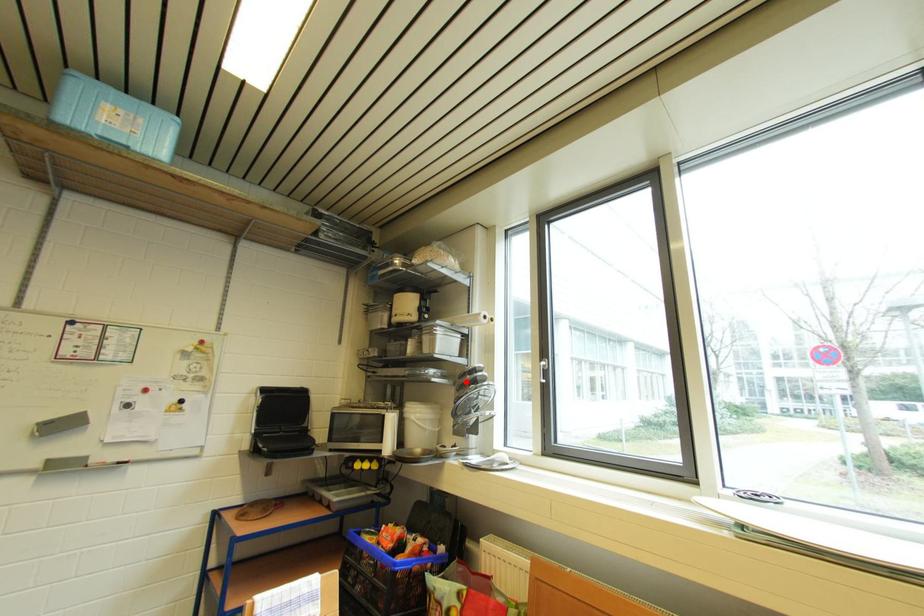
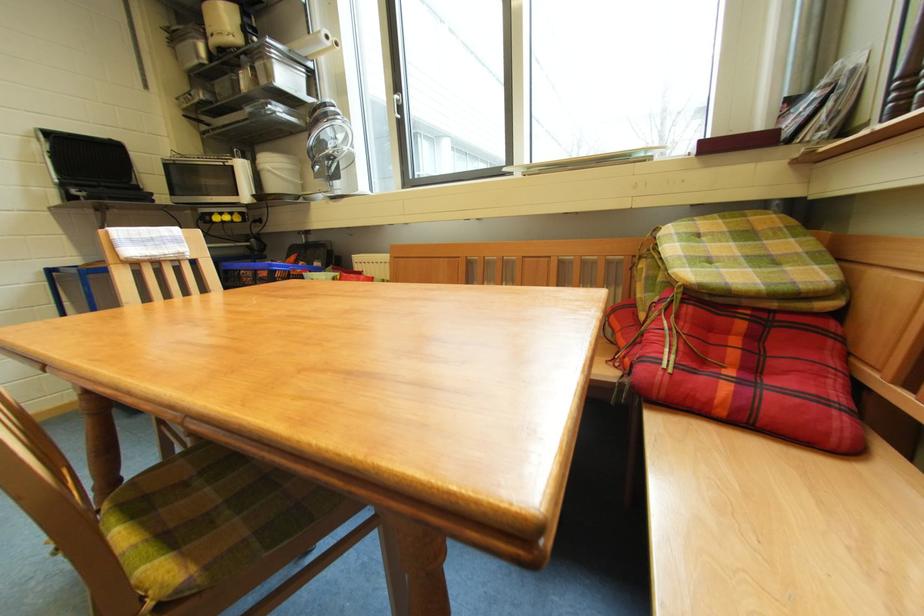
Where in the second image is the point corresponding to the highlighted location from the first image?

(319, 121)